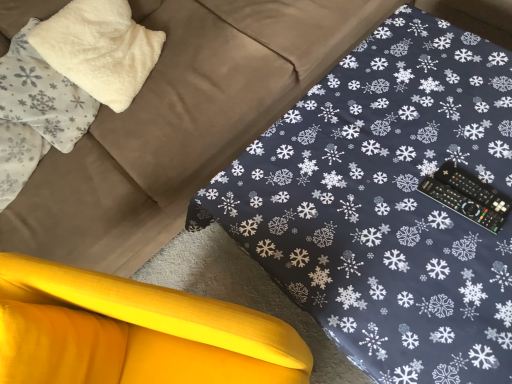
Identify the location of yellow fabric cushion at lower left. The width and height of the screenshot is (512, 384). (133, 332).

What are the coordinates of `white fluffy pillow at upper left, which is counted as the 1th pillow, starting from the left` in the screenshot? It's located at (42, 95).

This screenshot has height=384, width=512. Describe the element at coordinates (99, 49) in the screenshot. I see `white fluffy pillow at upper left, the first pillow when ordered from right to left` at that location.

Identify the location of yellow fabric cushion at lower left. (133, 332).

Is yellow fabric cushion at lower left aimed at white fluffy pillow at upper left, which is counted as the 1th pillow, starting from the left?

No, yellow fabric cushion at lower left is not turned towards white fluffy pillow at upper left, which is counted as the 1th pillow, starting from the left.

Is yellow fabric cushion at lower left in contact with white fluffy pillow at upper left, which is counted as the 1th pillow, starting from the left?

No, yellow fabric cushion at lower left is not touching white fluffy pillow at upper left, which is counted as the 1th pillow, starting from the left.

Is yellow fabric cushion at lower left further to camera compared to white fluffy pillow at upper left, which is the 2th pillow in right-to-left order?

No, it is in front of white fluffy pillow at upper left, which is the 2th pillow in right-to-left order.

Is white fluffy pillow at upper left, which ranks as the 2th pillow in left-to-right order, beside yellow fabric cushion at lower left?

No, white fluffy pillow at upper left, which ranks as the 2th pillow in left-to-right order, is not touching yellow fabric cushion at lower left.

Looking at this image, is white fluffy pillow at upper left, which ranks as the 2th pillow in left-to-right order, at the left side of yellow fabric cushion at lower left?

Yes, white fluffy pillow at upper left, which ranks as the 2th pillow in left-to-right order, is to the left of yellow fabric cushion at lower left.

Which of these two, white fluffy pillow at upper left, the first pillow when ordered from right to left, or yellow fabric cushion at lower left, stands shorter?

white fluffy pillow at upper left, the first pillow when ordered from right to left, is shorter.

Is yellow fabric cushion at lower left completely or partially inside white fluffy pillow at upper left, which ranks as the 2th pillow in left-to-right order?

No, yellow fabric cushion at lower left is located outside of white fluffy pillow at upper left, which ranks as the 2th pillow in left-to-right order.

Based on the photo, from a real-world perspective, which object rests below the other?

yellow fabric cushion at lower left is physically lower.

Are white fluffy pillow at upper left, which is the 2th pillow in right-to-left order, and yellow fabric cushion at lower left far apart?

That's not correct — white fluffy pillow at upper left, which is the 2th pillow in right-to-left order, is a little close to yellow fabric cushion at lower left.

Which object is positioned more to the left, white fluffy pillow at upper left, which is counted as the 1th pillow, starting from the left, or yellow fabric cushion at lower left?

Positioned to the left is white fluffy pillow at upper left, which is counted as the 1th pillow, starting from the left.

Is white fluffy pillow at upper left, which is the 2th pillow in right-to-left order, not within yellow fabric cushion at lower left?

Absolutely, white fluffy pillow at upper left, which is the 2th pillow in right-to-left order, is external to yellow fabric cushion at lower left.

Considering the positions of point (474, 219) and point (111, 65), is point (474, 219) closer or farther from the camera than point (111, 65)?

Clearly, point (474, 219) is closer to the camera than point (111, 65).

Is white fluffy pillow at upper left, which ranks as the 2th pillow in left-to-right order, surrounded by black plastic remote at right?

No, black plastic remote at right does not contain white fluffy pillow at upper left, which ranks as the 2th pillow in left-to-right order.

From the image's perspective, is black plastic remote at right positioned above or below white fluffy pillow at upper left, which ranks as the 2th pillow in left-to-right order?

Based on their image positions, black plastic remote at right is located beneath white fluffy pillow at upper left, which ranks as the 2th pillow in left-to-right order.

Between black plastic remote at right and white fluffy pillow at upper left, which ranks as the 2th pillow in left-to-right order, which one has larger width?

white fluffy pillow at upper left, which ranks as the 2th pillow in left-to-right order, is wider.

Is the surface of white fluffy pillow at upper left, which ranks as the 2th pillow in left-to-right order, in direct contact with white fluffy pillow at upper left, which is the 2th pillow in right-to-left order?

No.

At what (x,y) coordinates should I click in order to perform the action: click on pillow that appears below the white fluffy pillow at upper left, which is the 2th pillow in right-to-left order (from a real-world perspective). Please return your answer as a coordinate pair (x, y). Looking at the image, I should click on [99, 49].

From a real-world perspective, between white fluffy pillow at upper left, which ranks as the 2th pillow in left-to-right order, and white fluffy pillow at upper left, which is counted as the 1th pillow, starting from the left, who is vertically higher?

white fluffy pillow at upper left, which is counted as the 1th pillow, starting from the left, from a real-world perspective.

Does white fluffy pillow at upper left, which is the 2th pillow in right-to-left order, appear on the left side of white fluffy pillow at upper left, the first pillow when ordered from right to left?

Indeed, white fluffy pillow at upper left, which is the 2th pillow in right-to-left order, is positioned on the left side of white fluffy pillow at upper left, the first pillow when ordered from right to left.

Is point (23, 50) farther from viewer compared to point (46, 52)?

That is False.

From the image's perspective, is white fluffy pillow at upper left, which is the 2th pillow in right-to-left order, on white fluffy pillow at upper left, the first pillow when ordered from right to left?

No.

Is white fluffy pillow at upper left, which is the 2th pillow in right-to-left order, turned away from white fluffy pillow at upper left, which ranks as the 2th pillow in left-to-right order?

No, white fluffy pillow at upper left, which is the 2th pillow in right-to-left order, is not facing the opposite direction of white fluffy pillow at upper left, which ranks as the 2th pillow in left-to-right order.

From a real-world perspective, which is physically below, black plastic remote at right or white fluffy pillow at upper left, which is the 2th pillow in right-to-left order?

black plastic remote at right is physically lower.

Identify the location of control below the white fluffy pillow at upper left, which is the 2th pillow in right-to-left order (from the image's perspective). (467, 196).

Considering the positions of objects black plastic remote at right and white fluffy pillow at upper left, which is the 2th pillow in right-to-left order, in the image provided, who is more to the right, black plastic remote at right or white fluffy pillow at upper left, which is the 2th pillow in right-to-left order,?

black plastic remote at right.

In the image, there is a white fluffy pillow at upper left, which is the 2th pillow in right-to-left order. Where is `furniture below it (from the image's perspective)`? furniture below it (from the image's perspective) is located at coordinates (133, 332).

Find the location of a particular element. This screenshot has width=512, height=384. the 2nd pillow behind the yellow fabric cushion at lower left, counting from the anchor's position is located at coordinates (99, 49).

Considering their positions, is white fluffy pillow at upper left, which ranks as the 2th pillow in left-to-right order, positioned further to white fluffy pillow at upper left, which is counted as the 1th pillow, starting from the left, than yellow fabric cushion at lower left?

The object further to white fluffy pillow at upper left, which is counted as the 1th pillow, starting from the left, is yellow fabric cushion at lower left.

When comparing their distances from white fluffy pillow at upper left, the first pillow when ordered from right to left, does yellow fabric cushion at lower left or black plastic remote at right seem further?

The object further to white fluffy pillow at upper left, the first pillow when ordered from right to left, is black plastic remote at right.

From the image, which object appears to be nearer to white fluffy pillow at upper left, which is counted as the 1th pillow, starting from the left, yellow fabric cushion at lower left or white fluffy pillow at upper left, which ranks as the 2th pillow in left-to-right order?

white fluffy pillow at upper left, which ranks as the 2th pillow in left-to-right order, lies closer to white fluffy pillow at upper left, which is counted as the 1th pillow, starting from the left, than the other object.

Considering their positions, is yellow fabric cushion at lower left positioned further to white fluffy pillow at upper left, which is counted as the 1th pillow, starting from the left, than black plastic remote at right?

black plastic remote at right.

Looking at the image, which one is located closer to white fluffy pillow at upper left, the first pillow when ordered from right to left, black plastic remote at right or white fluffy pillow at upper left, which is counted as the 1th pillow, starting from the left?

Among the two, white fluffy pillow at upper left, which is counted as the 1th pillow, starting from the left, is located nearer to white fluffy pillow at upper left, the first pillow when ordered from right to left.

Based on their spatial positions, is black plastic remote at right or white fluffy pillow at upper left, which is the 2th pillow in right-to-left order, closer to yellow fabric cushion at lower left?

Answer: black plastic remote at right is closer to yellow fabric cushion at lower left.

Looking at the image, which one is located further to black plastic remote at right, white fluffy pillow at upper left, which ranks as the 2th pillow in left-to-right order, or white fluffy pillow at upper left, which is counted as the 1th pillow, starting from the left?

white fluffy pillow at upper left, which is counted as the 1th pillow, starting from the left, is positioned further to the anchor black plastic remote at right.

Looking at the image, which one is located further to white fluffy pillow at upper left, which is the 2th pillow in right-to-left order, black plastic remote at right or white fluffy pillow at upper left, the first pillow when ordered from right to left?

black plastic remote at right lies further to white fluffy pillow at upper left, which is the 2th pillow in right-to-left order, than the other object.

The width and height of the screenshot is (512, 384). Find the location of `furniture between white fluffy pillow at upper left, which ranks as the 2th pillow in left-to-right order, and black plastic remote at right from left to right`. furniture between white fluffy pillow at upper left, which ranks as the 2th pillow in left-to-right order, and black plastic remote at right from left to right is located at coordinates (133, 332).

The width and height of the screenshot is (512, 384). I want to click on pillow between white fluffy pillow at upper left, which ranks as the 2th pillow in left-to-right order, and yellow fabric cushion at lower left, in the vertical direction, so click(x=42, y=95).

Where is `pillow situated between white fluffy pillow at upper left, which is the 2th pillow in right-to-left order, and black plastic remote at right from left to right`? The image size is (512, 384). pillow situated between white fluffy pillow at upper left, which is the 2th pillow in right-to-left order, and black plastic remote at right from left to right is located at coordinates (99, 49).

This screenshot has height=384, width=512. I want to click on furniture between white fluffy pillow at upper left, which is the 2th pillow in right-to-left order, and black plastic remote at right from left to right, so [x=133, y=332].